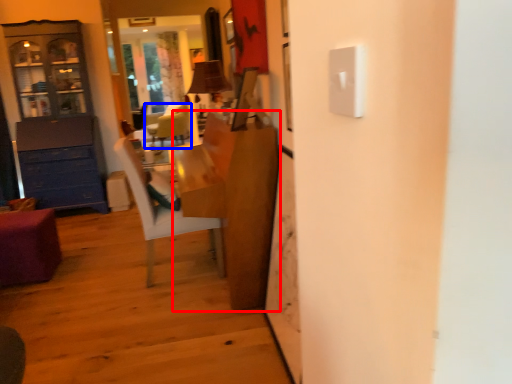
Question: Which of the following is the farthest to the observer, table (highlighted by a red box) or chair (highlighted by a blue box)?

Choices:
 (A) table
 (B) chair

Answer: (B)